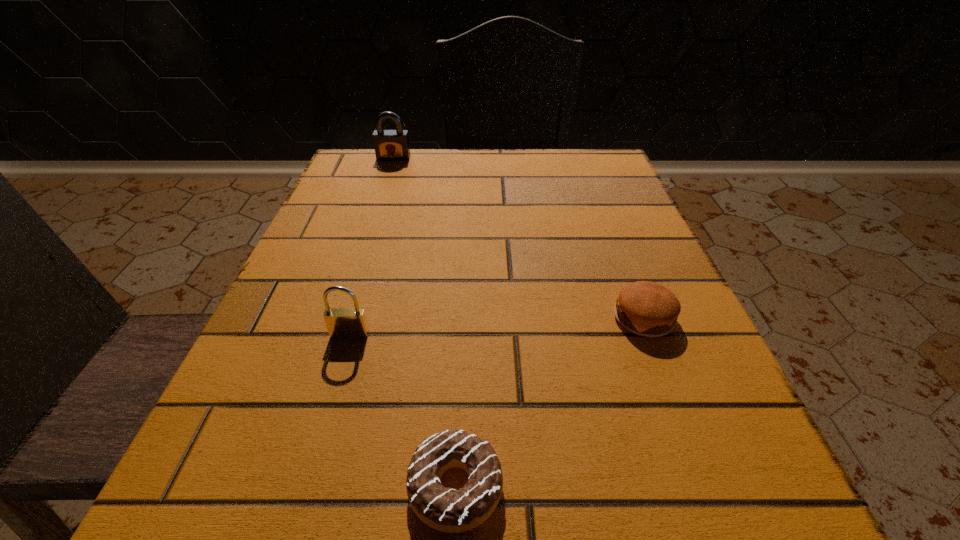
Find the location of a particular element. free region located 0.270m on the back of the third tallest object is located at coordinates (602, 207).

The image size is (960, 540). In order to click on vacant area situated on the back of the second object from right to left in this screenshot , I will do (465, 269).

Where is `object at the far edge`? The width and height of the screenshot is (960, 540). object at the far edge is located at coordinates (390, 145).

This screenshot has height=540, width=960. In order to click on object that is at the near edge in this screenshot , I will do `click(448, 510)`.

This screenshot has height=540, width=960. What are the coordinates of `object positioned at the right edge` in the screenshot? It's located at (648, 309).

Image resolution: width=960 pixels, height=540 pixels. What are the coordinates of `object present at the far left corner` in the screenshot? It's located at (390, 145).

The image size is (960, 540). What are the coordinates of `vacant space at the far edge of the desktop` in the screenshot? It's located at (511, 198).

In order to click on vacant space at the left edge of the desktop in this screenshot , I will do `click(338, 226)`.

Identify the location of vacant region at the right edge of the desktop. The image size is (960, 540). (572, 244).

At what (x,y) coordinates should I click in order to perform the action: click on vacant space at the far left corner of the desktop. Please return your answer as a coordinate pair (x, y). Looking at the image, I should click on (354, 176).